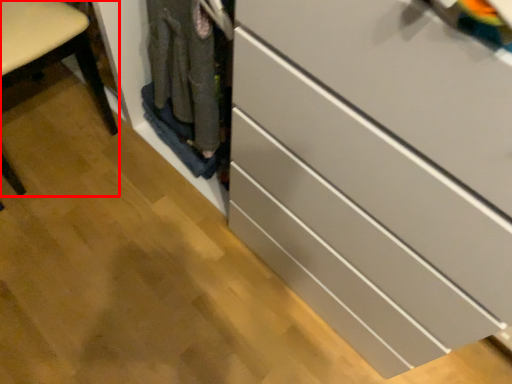
Question: From the image's perspective, where is furniture (annotated by the red box) located relative to chest of drawers?

Choices:
 (A) above
 (B) below

Answer: (A)